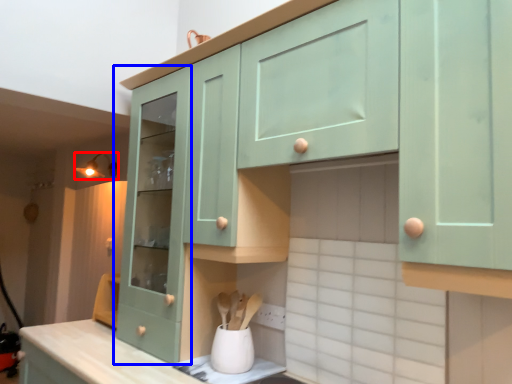
Question: Which of the following is the farthest to the observer, light fixture (highlighted by a red box) or cabinetry (highlighted by a blue box)?

Choices:
 (A) light fixture
 (B) cabinetry

Answer: (A)